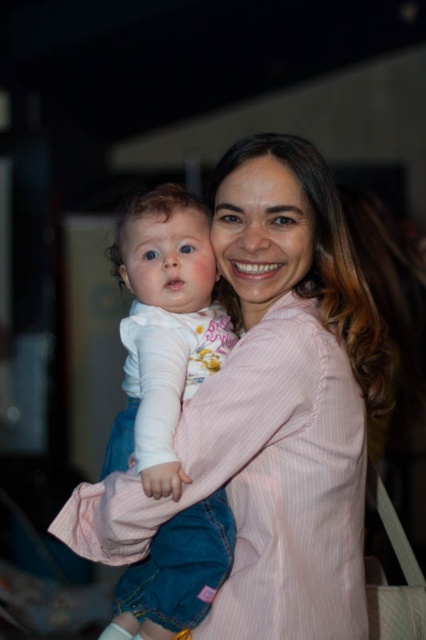
Describe the element at coordinates (271, 410) in the screenshot. I see `pink striped shirt at center` at that location.

Which is more to the left, pink striped shirt at center or white soft fabric baby at center?

white soft fabric baby at center

Is point (114, 532) behind point (155, 536)?

That is False.

At what (x,y) coordinates should I click in order to perform the action: click on pink striped shirt at center. Please return your answer as a coordinate pair (x, y). Looking at the image, I should click on (271, 410).